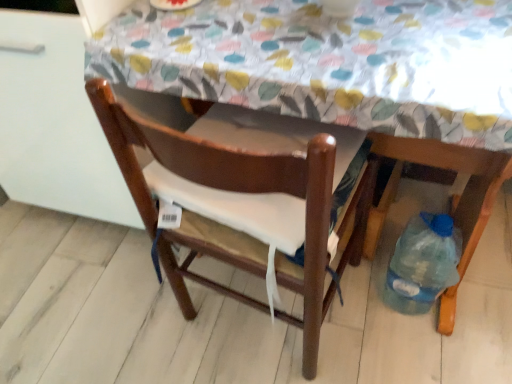
Locate an element on the screen. This screenshot has height=384, width=512. free spot to the left of translucent plastic bottle at lower right, which ranks as the first chair in right-to-left order is located at coordinates (360, 315).